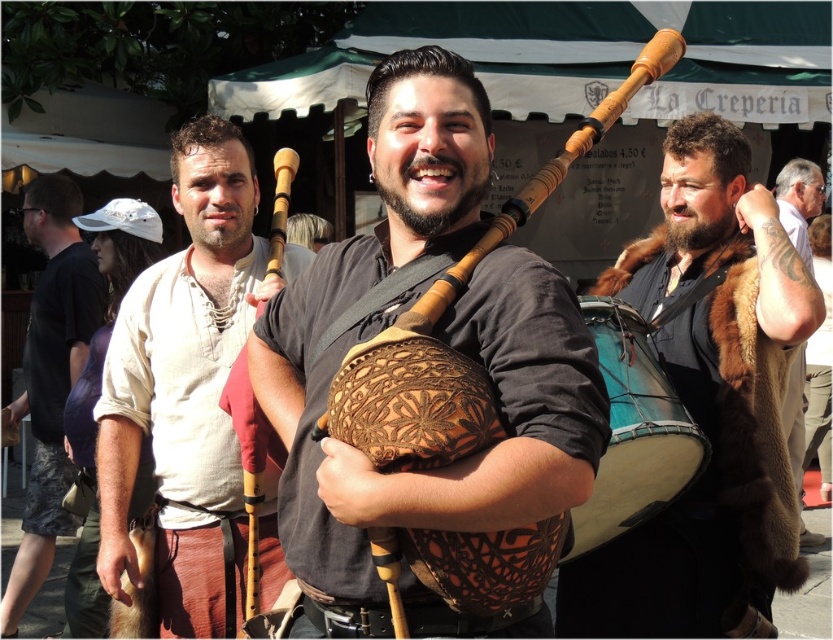
Question: Which of the following is the closest to the observer?

Choices:
 (A) (200, 266)
 (B) (792, 193)
 (C) (8, 584)

Answer: (A)

Question: Is wooden bagpipe at center further to the viewer compared to dark brown fur coat at right?

Choices:
 (A) yes
 (B) no

Answer: (B)

Question: Which object appears farthest from the camera in this image?

Choices:
 (A) blue leather drum at right
 (B) wooden bagpipe at center

Answer: (A)

Question: Which point is closer to the camera?

Choices:
 (A) brown leather bagpipe at center
 (B) light beige fabric shirt at center
 (C) wooden bagpipe at center
 (D) brown fur coat at right

Answer: (A)

Question: Is light beige fabric shirt at center closer to camera compared to blue leather drum at right?

Choices:
 (A) yes
 (B) no

Answer: (B)

Question: Considering the relative positions of light beige fabric shirt at center and blue leather drum at right in the image provided, where is light beige fabric shirt at center located with respect to blue leather drum at right?

Choices:
 (A) above
 (B) below

Answer: (A)